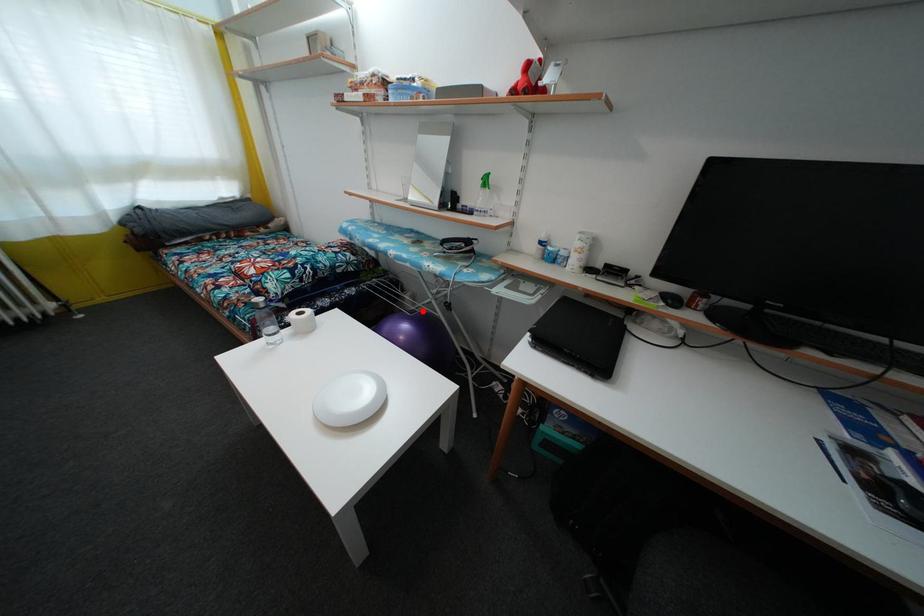
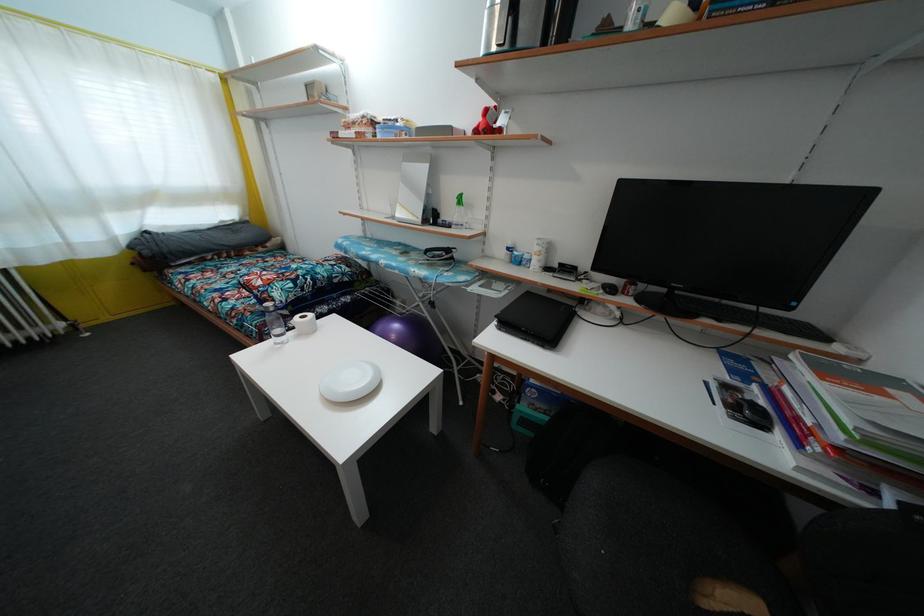
Question: A red point is marked in image1. In image2, is the corresponding 3D point closer to the camera or farther? Reply with the corresponding letter.

Choices:
 (A) The corresponding 3D point is closer.
 (B) The corresponding 3D point is farther.

Answer: (B)